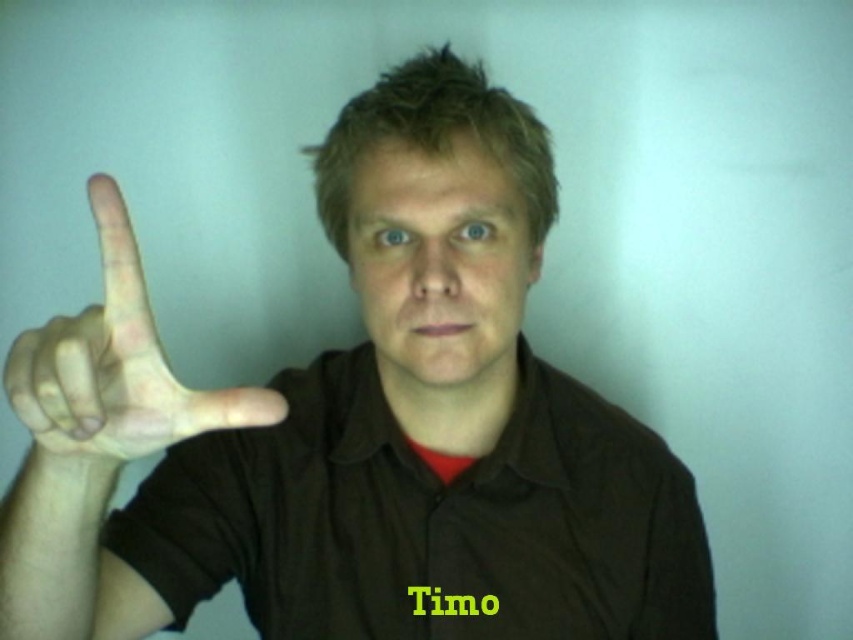
Describe the element at coordinates (427, 520) in the screenshot. Image resolution: width=853 pixels, height=640 pixels. I see `brown cotton polo shirt at center` at that location.

Which is behind, point (370, 348) or point (474, 256)?

The point (370, 348) is behind.

The width and height of the screenshot is (853, 640). I want to click on brown cotton polo shirt at center, so tap(427, 520).

Is matte brown face at center positioned behind skinny flesh-colored hand at left?

Yes, matte brown face at center is behind skinny flesh-colored hand at left.

Does matte brown face at center appear over skinny flesh-colored hand at left?

Indeed, matte brown face at center is positioned over skinny flesh-colored hand at left.

The image size is (853, 640). Describe the element at coordinates (439, 264) in the screenshot. I see `matte brown face at center` at that location.

At what (x,y) coordinates should I click in order to perform the action: click on matte brown face at center. Please return your answer as a coordinate pair (x, y). Looking at the image, I should click on (439, 264).

Which is in front, point (549, 449) or point (61, 346)?

Positioned in front is point (61, 346).

The width and height of the screenshot is (853, 640). What do you see at coordinates (427, 520) in the screenshot? I see `brown cotton polo shirt at center` at bounding box center [427, 520].

The image size is (853, 640). Identify the location of brown cotton polo shirt at center. (427, 520).